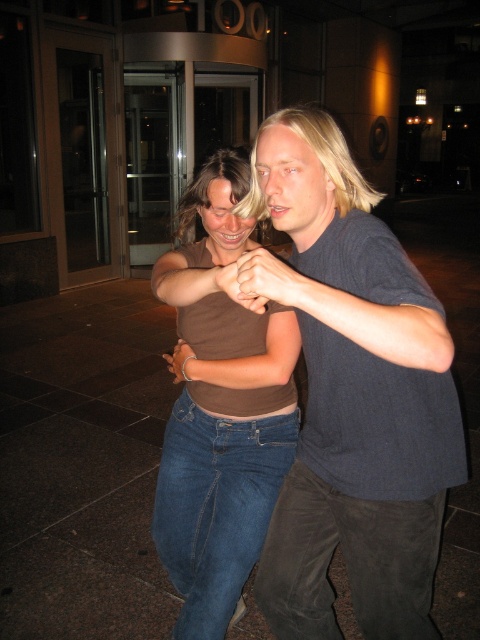
You are standing at the origin point in the image and want to move towards the brown matte shirt at center. Which direction should you move in terms of the coordinate system provided?

The brown matte shirt at center is located at point 0.644 on the x and 0.460 on the y, so you should move towards the right and slightly upwards from the origin to reach it.

You are a photographer trying to capture a candid shot of the two people in the scene. You want to ensure that both the blue denim jeans at center and the matte brown hand at center are clearly visible in your photo. Given their relative sizes, which object should you focus on first to ensure proper framing?

The blue denim jeans at center is taller than the matte brown hand at center, so you should focus on the blue denim jeans at center first to ensure proper framing as it is larger and might require more attention in the composition.

You are standing in front of the building with the revolving doors and see two points marked in the image. Which point, point (x=166, y=440) or point (x=166, y=563), is closer to you?

Point (x=166, y=440) is closer to you than point (x=166, y=563).